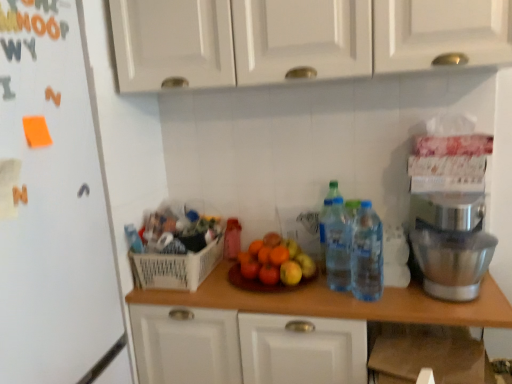
Question: Considering the positions of point (369, 225) and point (321, 268), is point (369, 225) closer or farther from the camera than point (321, 268)?

Choices:
 (A) closer
 (B) farther

Answer: (A)

Question: Visually, is translucent plastic bottles at center right positioned to the left or to the right of translucent plastic water bottles at center-right, acting as the first bottle starting from the right?

Choices:
 (A) left
 (B) right

Answer: (B)

Question: Estimate the real-world distances between objects in this image. Which object is closer to the wooden at center?

Choices:
 (A) translucent plastic bottle at center, which is the 1th bottle in back-to-front order
 (B) translucent plastic water bottles at center-right, the second bottle viewed from the front
 (C) white matte refrigerator at left
 (D) shiny wooden plate at center
 (E) silver metallic stand mixer at right

Answer: (D)

Question: Which of these objects is positioned farthest from the translucent plastic bottles at center, the third bottle viewed from the back?

Choices:
 (A) shiny wooden plate at center
 (B) translucent plastic water bottles at center-right, acting as the first bottle starting from the right
 (C) white plastic basket at center
 (D) white glossy cabinet doors at upper center
 (E) silver metallic stand mixer at right

Answer: (D)